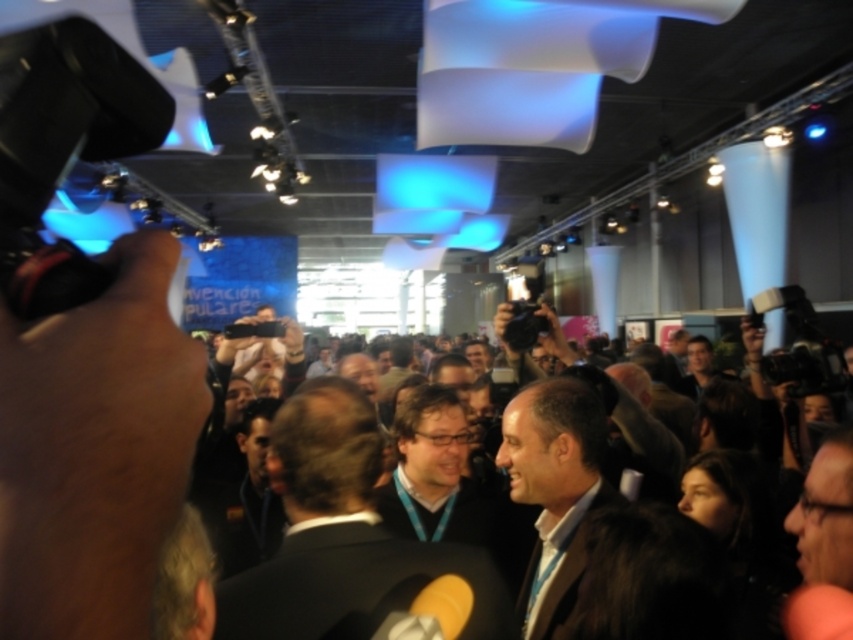
You are standing in the large hall and want to reach a specific point in the room. The point is located at coordinates point [573,572]. If your current position is 1.2 meters away from that point, can you safely walk to it without needing to move around any obstacles?

The distance of point [573,572] from viewer is 1.47 meters. Since your current position is 1.2 meters away from that point, you are already closer than the stated distance, which suggests there might be an inconsistency. However, assuming the provided distance is accurate, you can safely walk to the point as there is no mention of obstacles in the scene description.

You are standing in the large hall and want to take a photo of both point (425, 573) and point (453, 504). Which point should you focus on first to ensure both are in clear view?

Point (425, 573) is closer to the camera than point (453, 504). To ensure both are in clear view, focus on the closer point first, which is point (425, 573).

You are a photographer at the event and want to capture a clear shot of the dark brown hair at center without the matte black jacket at center blocking it. How should you adjust your camera angle?

The matte black jacket at center is below dark brown hair at center, so you can angle your camera upward to focus on the dark brown hair at center while avoiding the matte black jacket at center below it.